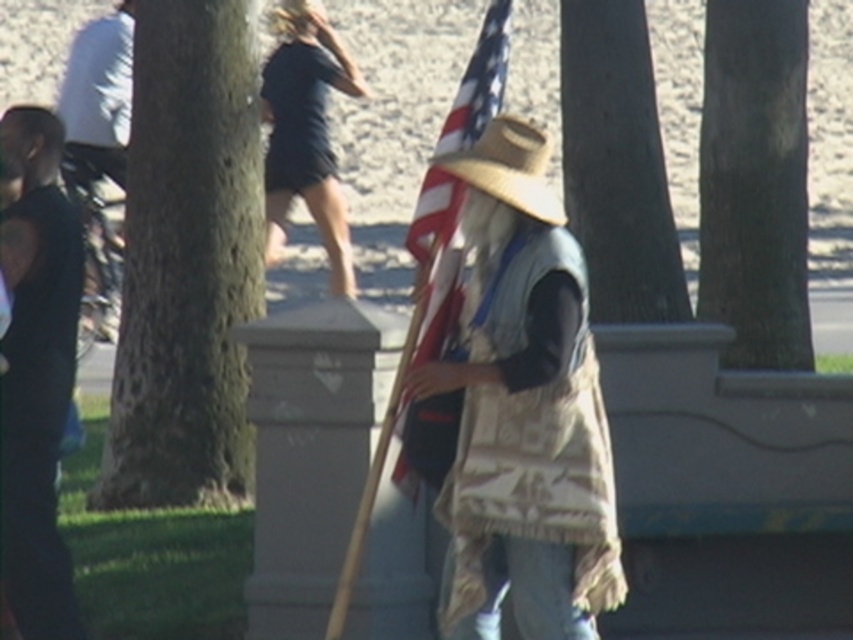
You are standing at the position of the viewer in the image. There is a green rough bark tree at left. If you want to reach the tree, how many steps would you need to take if each step is 2.5 feet long?

The distance between the green rough bark tree at left and the viewer is 36.85 feet. Each step is 2.5 feet long, so dividing 36.85 by 2.5 gives approximately 14.74 steps. Since you can only take whole steps, you would need to take 15 steps to reach the tree.

You are a photographer setting up a shot in the park. You want to frame the green rough bark tree at left and the tan woven cowboy hat at center in your photo. Which object should you adjust your camera angle to focus on first if you want to capture the wider object?

The green rough bark tree at left is wider than the tan woven cowboy hat at center, so you should focus on the green rough bark tree at left first to capture its width.

You are planning to place a 10 feet long bench between the green rough bark tree at left and the tan woven cowboy hat at center. Will there be enough space to place the bench without overlapping either object?

The distance between the green rough bark tree at left and the tan woven cowboy hat at center is 12.41 feet. Since the bench is 10 feet long, there is enough space to place it between them without overlapping either object.